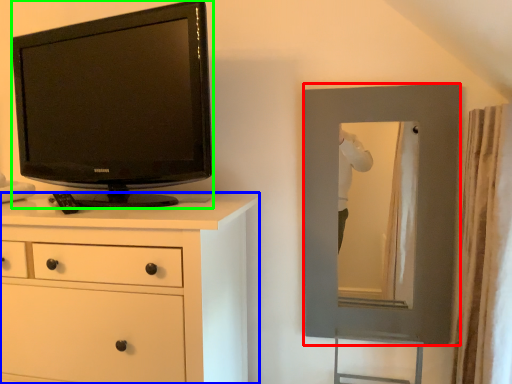
Question: Which object is the closest to the picture frame (highlighted by a red box)? Choose among these: chest of drawers (highlighted by a blue box) or television (highlighted by a green box).

Choices:
 (A) chest of drawers
 (B) television

Answer: (A)